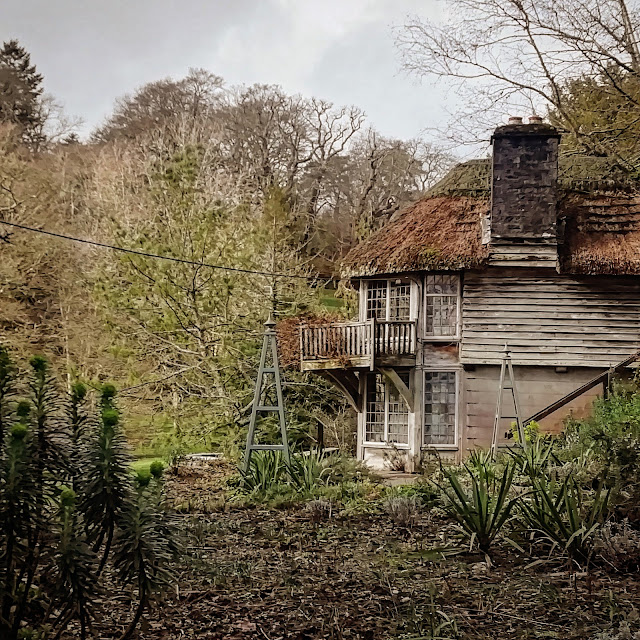
Identify the location of vent on top of chimney. The width and height of the screenshot is (640, 640). (513, 118), (539, 118).